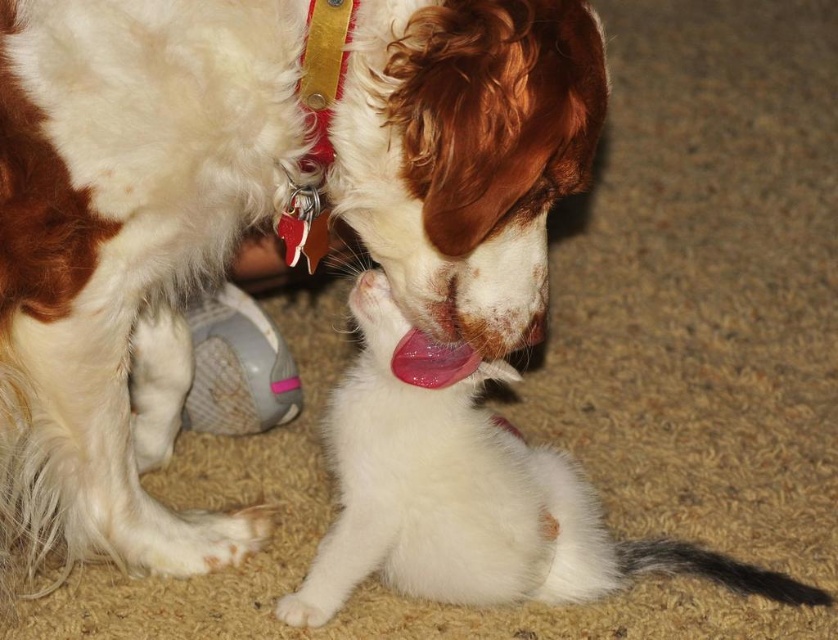
Question: Does white fluffy dog at center have a greater width compared to pink glossy tongue at center?

Choices:
 (A) yes
 (B) no

Answer: (A)

Question: Considering the real-world distances, which object is closest to the pink glossy tongue at center?

Choices:
 (A) white fur dog at center
 (B) pink glossy nose at center

Answer: (B)

Question: Estimate the real-world distances between objects in this image. Which object is farther from the pink glossy tongue at center?

Choices:
 (A) pink glossy nose at center
 (B) white fluffy dog at center
 (C) white fur dog at center

Answer: (B)

Question: Does white fur dog at center have a lesser width compared to pink glossy tongue at center?

Choices:
 (A) no
 (B) yes

Answer: (A)

Question: Is white fluffy dog at center to the left of white fur dog at center from the viewer's perspective?

Choices:
 (A) yes
 (B) no

Answer: (A)

Question: Which of the following is the farthest from the observer?

Choices:
 (A) white fluffy dog at center
 (B) pink glossy nose at center
 (C) pink glossy tongue at center
 (D) white fur dog at center

Answer: (B)